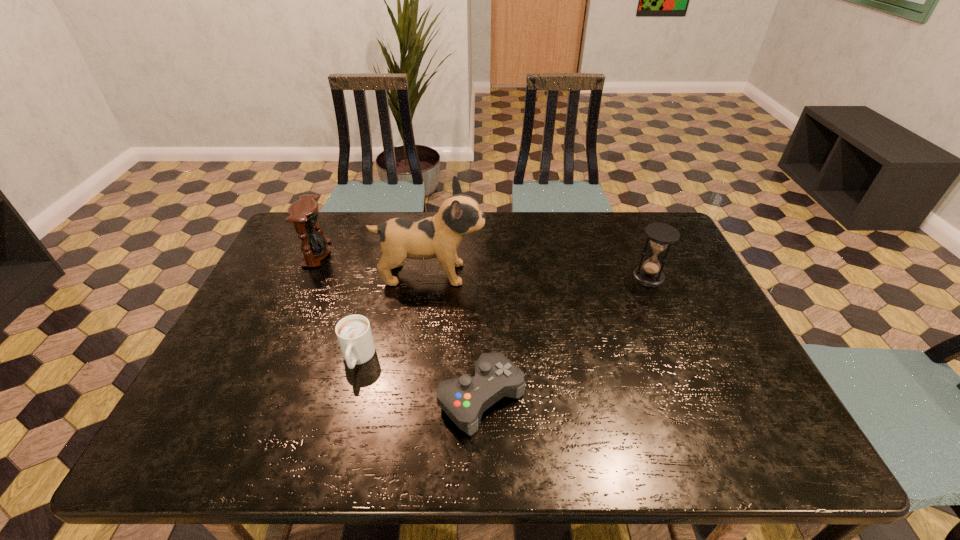
This screenshot has height=540, width=960. In order to click on the tallest object in this screenshot , I will do click(x=438, y=237).

Find the location of a particular element. Image resolution: width=960 pixels, height=540 pixels. the left hourglass is located at coordinates (304, 213).

Identify the location of the right hourglass. The width and height of the screenshot is (960, 540). (661, 235).

This screenshot has width=960, height=540. Find the location of `cappuccino`. cappuccino is located at coordinates (354, 334).

You are a GUI agent. You are given a task and a screenshot of the screen. Output one action in this format:
    pyautogui.click(x=<x>, y=<y>)
    Task: Click on the control
    The width and height of the screenshot is (960, 540).
    Given the screenshot: What is the action you would take?
    pyautogui.click(x=464, y=399)

The width and height of the screenshot is (960, 540). Find the location of `free location located at the face of the tallest object`. free location located at the face of the tallest object is located at coordinates (601, 274).

At what (x,y) coordinates should I click in order to perform the action: click on free location located on the left of the leftmost object. Please return your answer as a coordinate pair (x, y). This screenshot has height=540, width=960. Looking at the image, I should click on (287, 254).

This screenshot has width=960, height=540. Identify the location of vacant region located on the front of the rightmost object. (681, 350).

Locate an element on the screen. The width and height of the screenshot is (960, 540). vacant point located 0.170m on the side with the handle of the fourth tallest object is located at coordinates (334, 448).

Locate an element on the screen. vacant space located 0.190m on the right of the control is located at coordinates (611, 398).